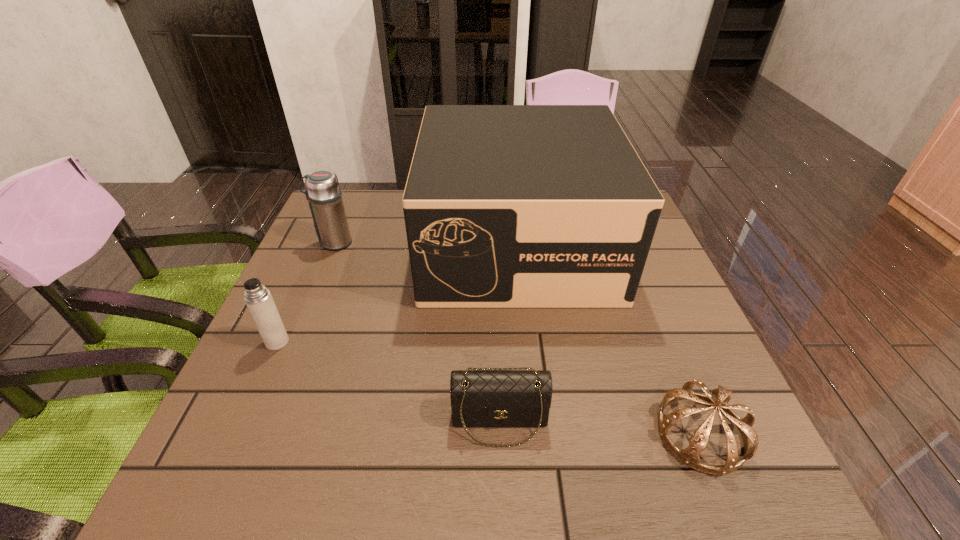
Where is `box`? This screenshot has height=540, width=960. box is located at coordinates (506, 206).

You are a GUI agent. You are given a task and a screenshot of the screen. Output one action in this format:
    pyautogui.click(x=<x>, y=<y>)
    Task: Click on the taller thermos bottle
    The image size is (960, 540).
    Given the screenshot: What is the action you would take?
    pyautogui.click(x=323, y=193)

This screenshot has width=960, height=540. What are the coordinates of `the farther thermos bottle` in the screenshot? It's located at (323, 193).

Find the location of a particular element. The height and width of the screenshot is (540, 960). the third tallest object is located at coordinates (258, 299).

At what (x,y) coordinates should I click in order to perform the action: click on the third nearest object. Please return your answer as a coordinate pair (x, y). Looking at the image, I should click on (258, 299).

Identify the location of clutch bag. (482, 397).

Find the location of a particular element. The image size is (960, 540). tiara is located at coordinates (720, 397).

Locate an element on the screen. free region located 0.200m on the front-facing side of the box is located at coordinates (532, 381).

At what (x,y) coordinates should I click in order to perform the action: click on blank area located 0.100m on the back of the third farthest object. Please return your answer as a coordinate pair (x, y). This screenshot has width=960, height=540. Looking at the image, I should click on (296, 301).

Where is `vacant space located on the left of the tiara`? This screenshot has height=540, width=960. vacant space located on the left of the tiara is located at coordinates coord(515,434).